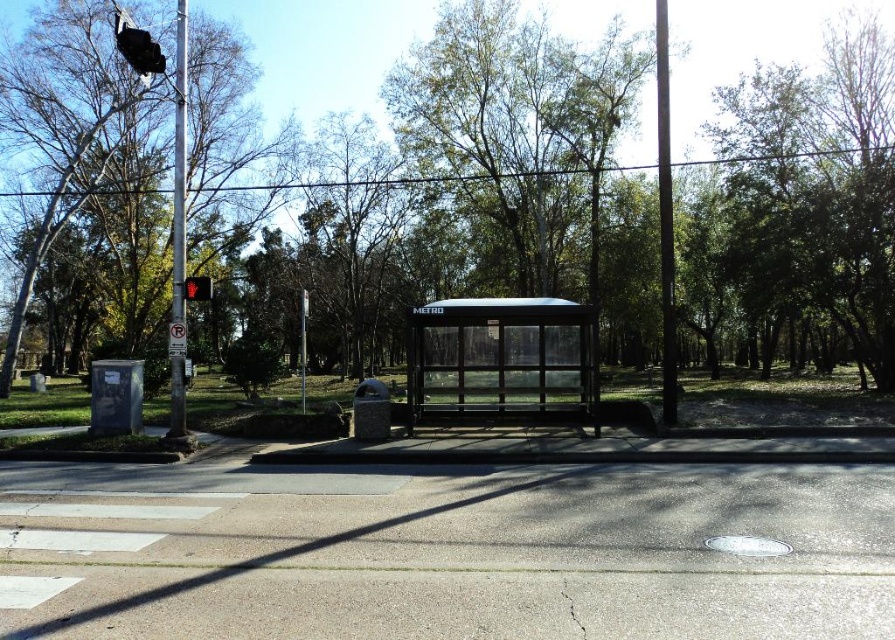
Which is more to the left, transparent glass bus stop at center or black plastic traffic light at upper left?

From the viewer's perspective, black plastic traffic light at upper left appears more on the left side.

Between transparent glass bus stop at center and black plastic traffic light at upper left, which one has more height?

black plastic traffic light at upper left is taller.

Is point (448, 349) in front of point (134, 44)?

No, it is behind (134, 44).

This screenshot has width=895, height=640. Find the location of `transparent glass bus stop at center`. transparent glass bus stop at center is located at coordinates (501, 358).

Looking at this image, does black metal pole at right have a larger size compared to metallic rectangular sign at upper center?

Yes, black metal pole at right is bigger than metallic rectangular sign at upper center.

Identify the location of black metal pole at right. (665, 218).

Does point (117, 16) lie in front of point (186, 291)?

Yes, it is.

Where is `black plastic traffic light at upper left`? black plastic traffic light at upper left is located at coordinates (137, 48).

I want to click on black plastic traffic light at upper left, so click(137, 48).